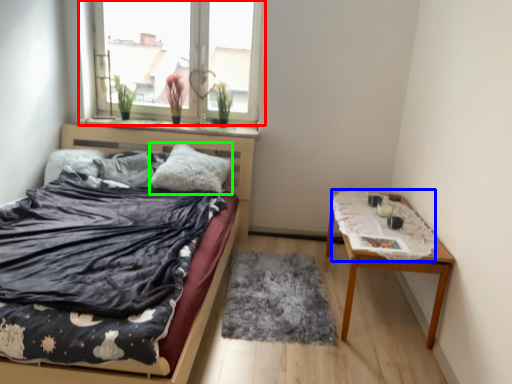
Question: Which object is the farthest from window (highlighted by a red box)? Choose among these: blanket (highlighted by a blue box) or pillow (highlighted by a green box).

Choices:
 (A) blanket
 (B) pillow

Answer: (A)